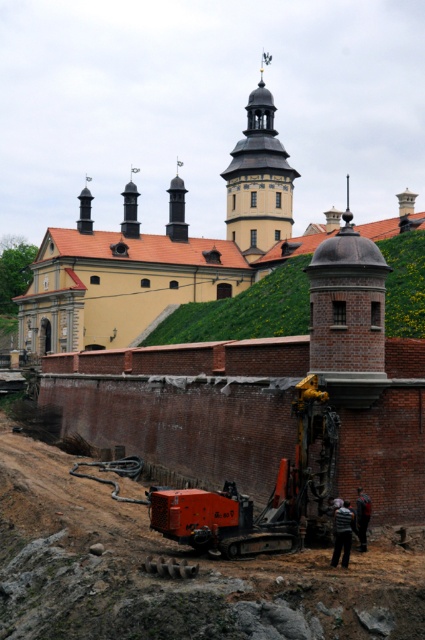
Question: Which point is closer to the camera taking this photo?

Choices:
 (A) (14, 484)
 (B) (305, 502)
 (C) (280, 168)

Answer: (B)

Question: Can you confirm if orange metallic excavator at center is positioned to the left of green grassy hillside at center?

Choices:
 (A) yes
 (B) no

Answer: (A)

Question: Among these objects, which one is farthest from the camera?

Choices:
 (A) brown dirt track at lower center
 (B) green grassy hillside at center
 (C) orange metallic excavator at center
 (D) matte yellow tower at center

Answer: (D)

Question: Is brown dirt track at lower center bigger than matte yellow tower at center?

Choices:
 (A) yes
 (B) no

Answer: (B)

Question: Which object is farther from the camera taking this photo?

Choices:
 (A) matte yellow tower at center
 (B) brown dirt track at lower center
 (C) green grassy hillside at center
 (D) orange metallic excavator at center

Answer: (A)

Question: In this image, where is brown dirt track at lower center located relative to matte yellow tower at center?

Choices:
 (A) above
 (B) below

Answer: (B)